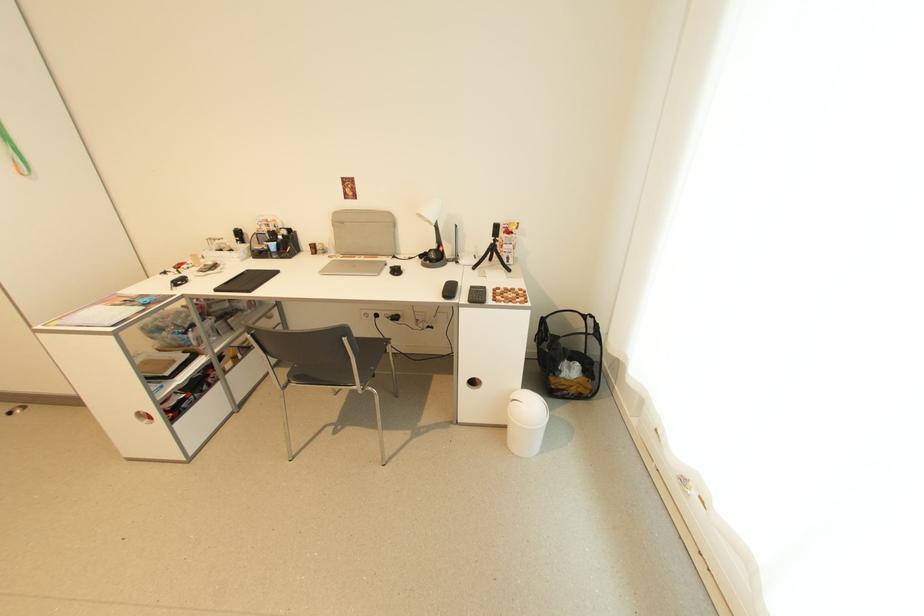
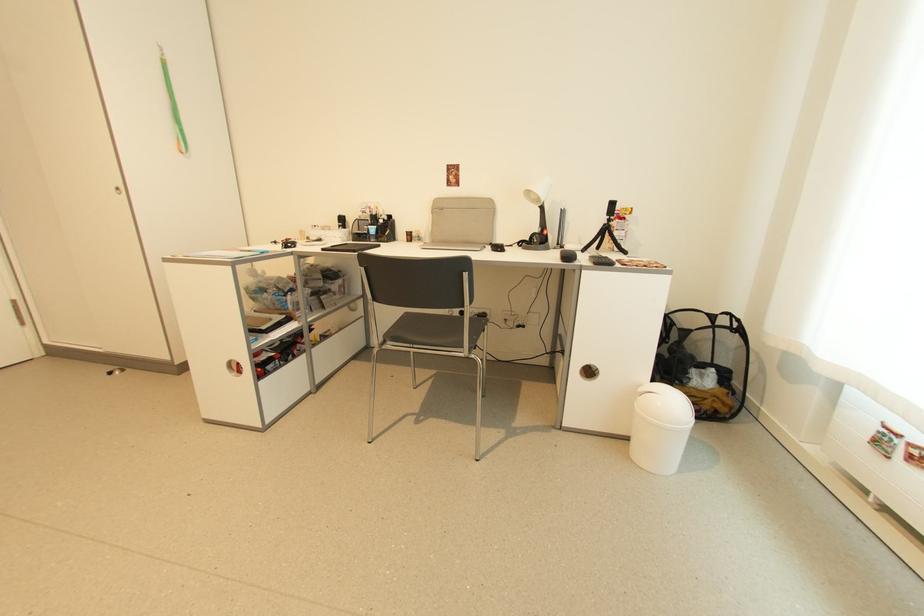
Where in the second image is the point corresponding to pixel 439 248 from the first image?

(541, 232)